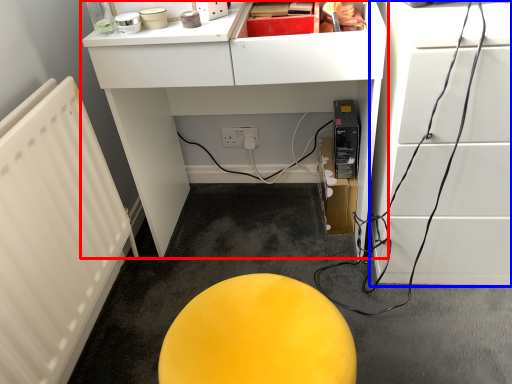
Question: Which point is further to the camera, furniture (highlighted by a red box) or furniture (highlighted by a blue box)?

Choices:
 (A) furniture
 (B) furniture

Answer: (A)